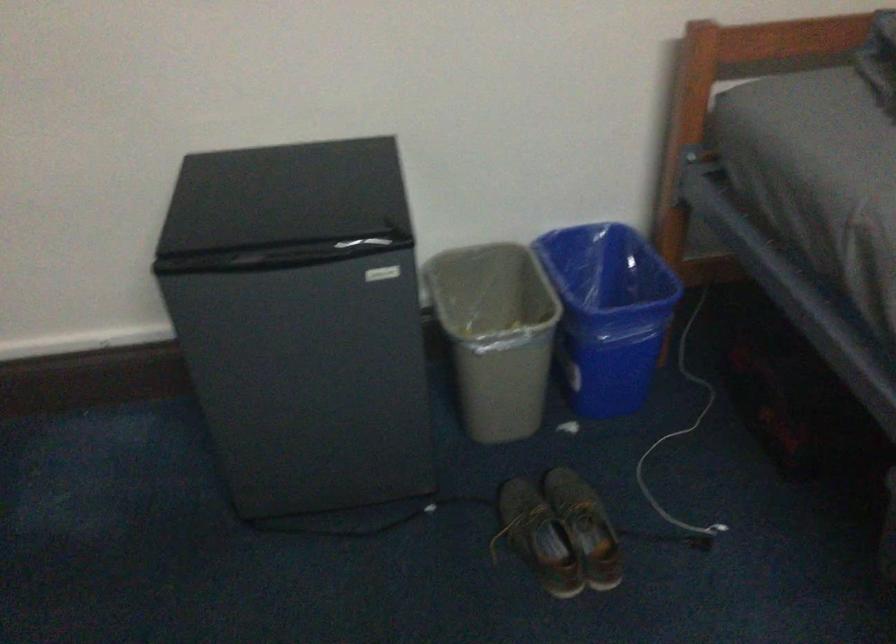
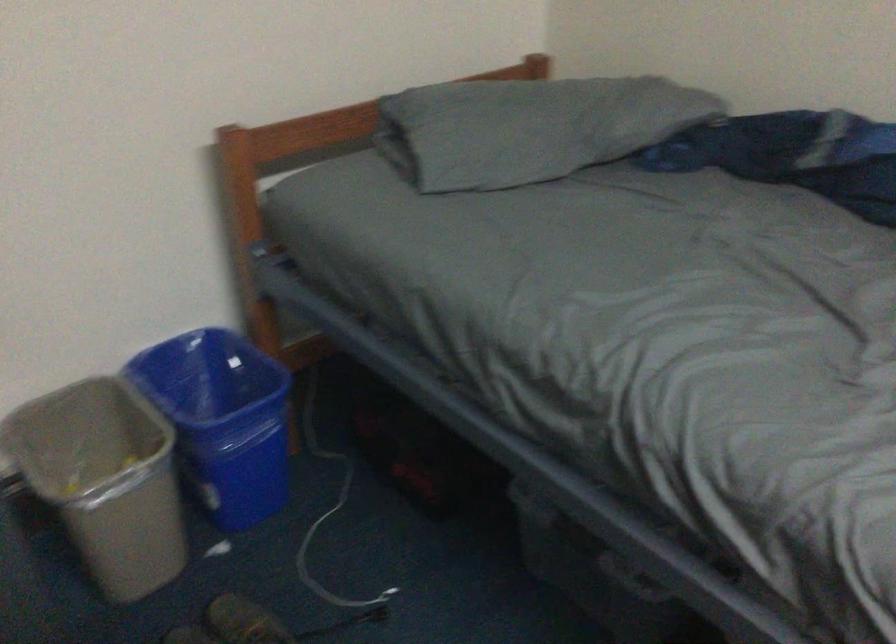
In the second image, find the point that corresponds to pixel 606 310 in the first image.

(221, 420)